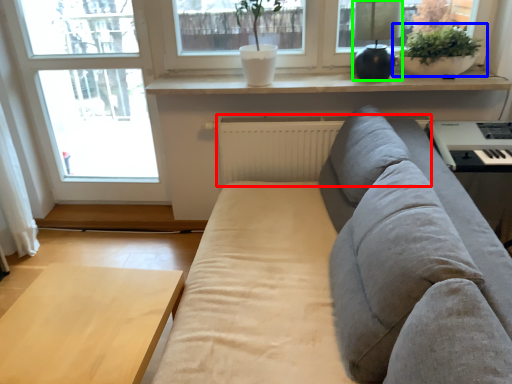
Question: Which object is positioned farthest from radiator (highlighted by a red box)? Select from houseplant (highlighted by a blue box) and lamp (highlighted by a green box).

Choices:
 (A) houseplant
 (B) lamp

Answer: (A)